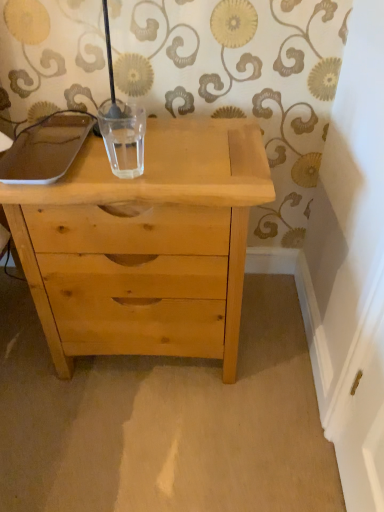
Identify the location of empty space that is ontop of natural wood chest of drawers at center (from a real-world perspective). Image resolution: width=384 pixels, height=512 pixels. (142, 152).